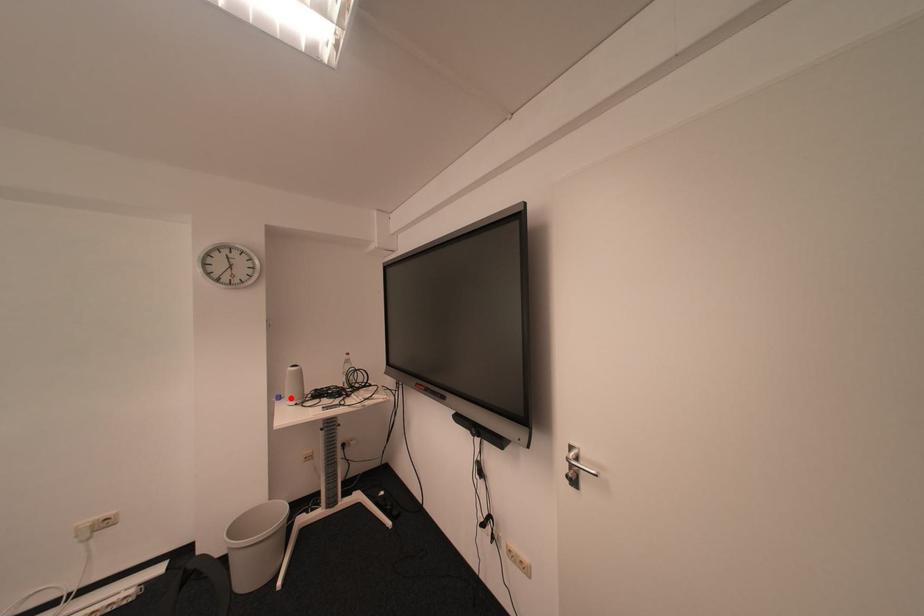
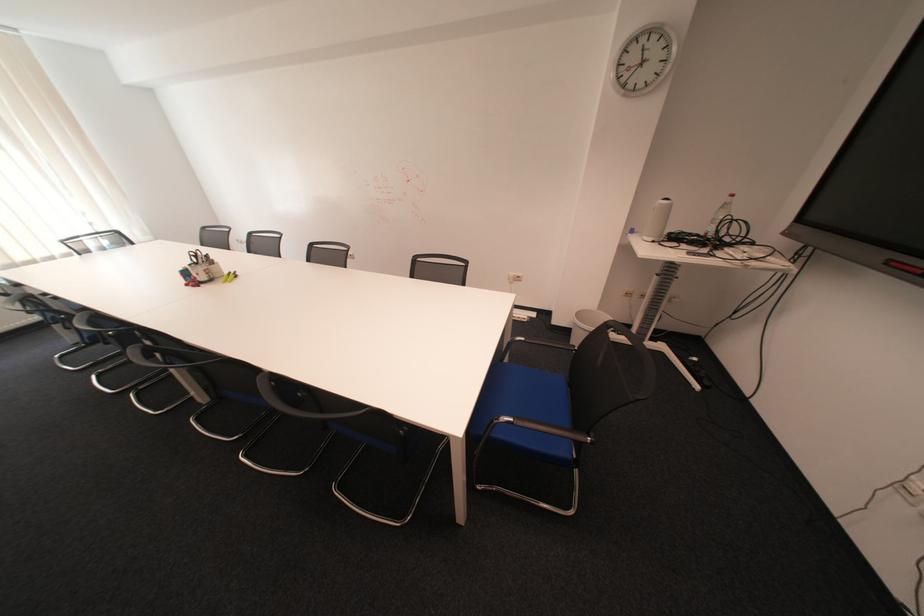
Question: I am providing you with two images of the same scene from different viewpoints. Given a red point in image1, look at the same physical point in image2. Is it:

Choices:
 (A) Closer to the viewpoint
 (B) Farther from the viewpoint

Answer: (A)